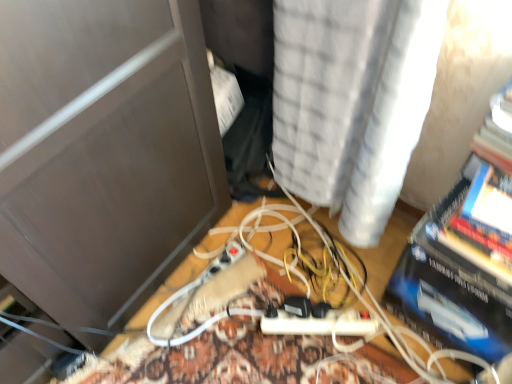
Question: Can you confirm if blue glossy paperback book at right is bigger than white textured curtain at upper center?

Choices:
 (A) yes
 (B) no

Answer: (B)

Question: From a real-world perspective, is blue glossy paperback book at right positioned under white textured curtain at upper center based on gravity?

Choices:
 (A) no
 (B) yes

Answer: (B)

Question: Is blue glossy paperback book at right closer to the viewer compared to white textured curtain at upper center?

Choices:
 (A) yes
 (B) no

Answer: (B)

Question: From the image's perspective, does blue glossy paperback book at right appear higher than white textured curtain at upper center?

Choices:
 (A) no
 (B) yes

Answer: (A)

Question: Is blue glossy paperback book at right turned away from white textured curtain at upper center?

Choices:
 (A) yes
 (B) no

Answer: (B)

Question: Considering the relative sizes of blue glossy paperback book at right and white textured curtain at upper center in the image provided, is blue glossy paperback book at right shorter than white textured curtain at upper center?

Choices:
 (A) no
 (B) yes

Answer: (B)

Question: Can you confirm if white textured curtain at upper center is shorter than blue glossy paperback book at right?

Choices:
 (A) yes
 (B) no

Answer: (B)

Question: Can you confirm if white textured curtain at upper center is wider than blue glossy paperback book at right?

Choices:
 (A) no
 (B) yes

Answer: (B)

Question: From the image's perspective, would you say white textured curtain at upper center is positioned over blue glossy paperback book at right?

Choices:
 (A) no
 (B) yes

Answer: (B)

Question: Is white textured curtain at upper center in front of blue glossy paperback book at right?

Choices:
 (A) yes
 (B) no

Answer: (A)

Question: Is white textured curtain at upper center turned away from blue glossy paperback book at right?

Choices:
 (A) yes
 (B) no

Answer: (B)

Question: Could you tell me if white textured curtain at upper center is facing blue glossy paperback book at right?

Choices:
 (A) yes
 (B) no

Answer: (B)

Question: Would you say white textured curtain at upper center is inside or outside blue glossy paperback book at right?

Choices:
 (A) inside
 (B) outside

Answer: (B)